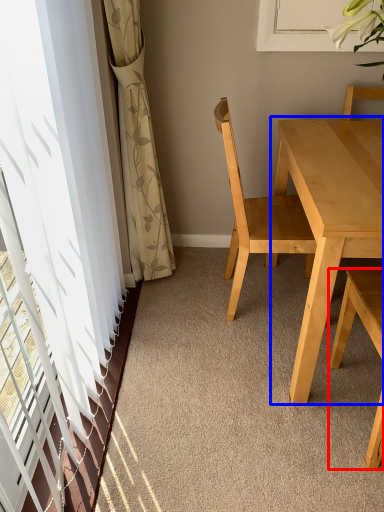
Question: Which point is closer to the camera, chair (highlighted by a red box) or kitchen & dining room table (highlighted by a blue box)?

Choices:
 (A) chair
 (B) kitchen & dining room table

Answer: (A)